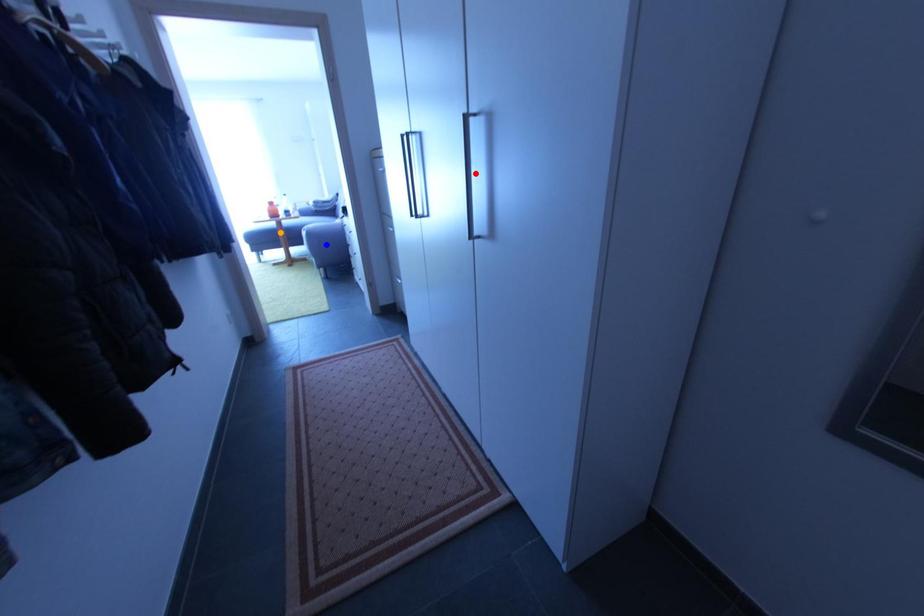
Order these from nearest to farthest:
red point
blue point
orange point

red point
blue point
orange point